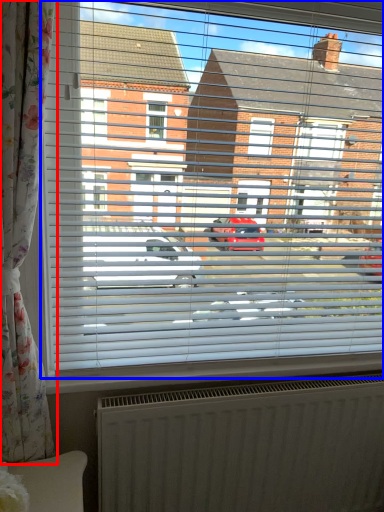
Question: Which object is closer to the camera taking this photo, curtain (highlighted by a red box) or window (highlighted by a blue box)?

Choices:
 (A) curtain
 (B) window

Answer: (A)